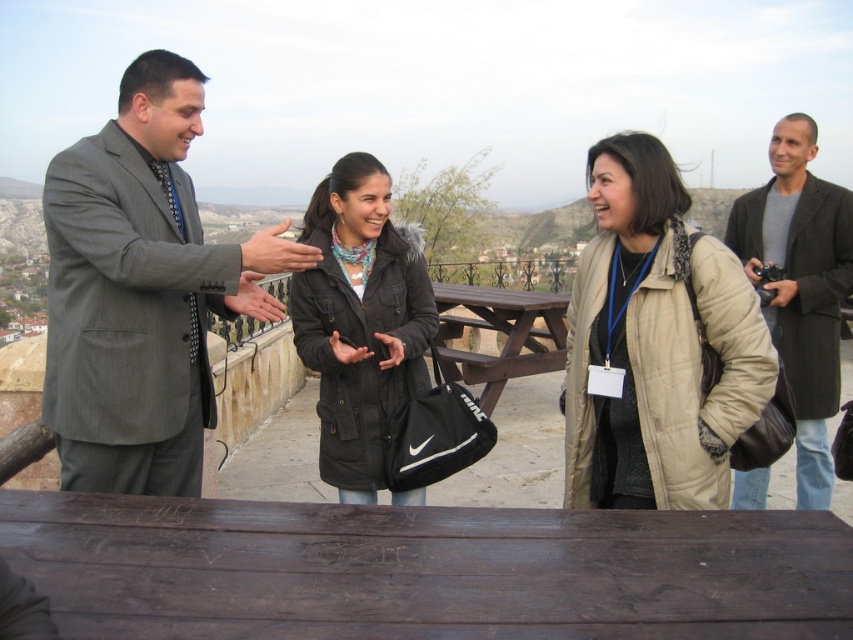
Looking at this image, does dark wood table at lower center appear on the left side of dark gray coat at right?

Yes, dark wood table at lower center is to the left of dark gray coat at right.

Is dark wood table at lower center taller than dark gray coat at right?

No, dark wood table at lower center is not taller than dark gray coat at right.

Image resolution: width=853 pixels, height=640 pixels. I want to click on dark wood table at lower center, so click(x=424, y=570).

Is the position of dark gray coat at right more distant than that of brown wooden picnic table at center?

No, it is not.

Can you confirm if dark gray coat at right is positioned to the right of brown wooden picnic table at center?

Correct, you'll find dark gray coat at right to the right of brown wooden picnic table at center.

Which is in front, point (817, 336) or point (497, 332)?

Positioned in front is point (817, 336).

Identify the location of dark gray coat at right. The height and width of the screenshot is (640, 853). (799, 288).

Between point (553, 541) and point (186, 131), which one is positioned in front?

Point (553, 541) is in front.

Identify the location of dark wood table at lower center. (424, 570).